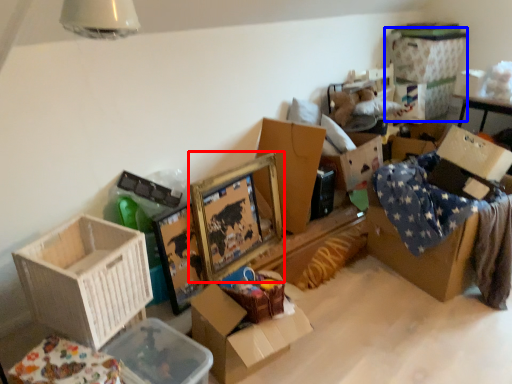
Question: Which object appears farthest to the camera in this image, picture frame (highlighted by a red box) or storage box (highlighted by a blue box)?

Choices:
 (A) picture frame
 (B) storage box

Answer: (B)